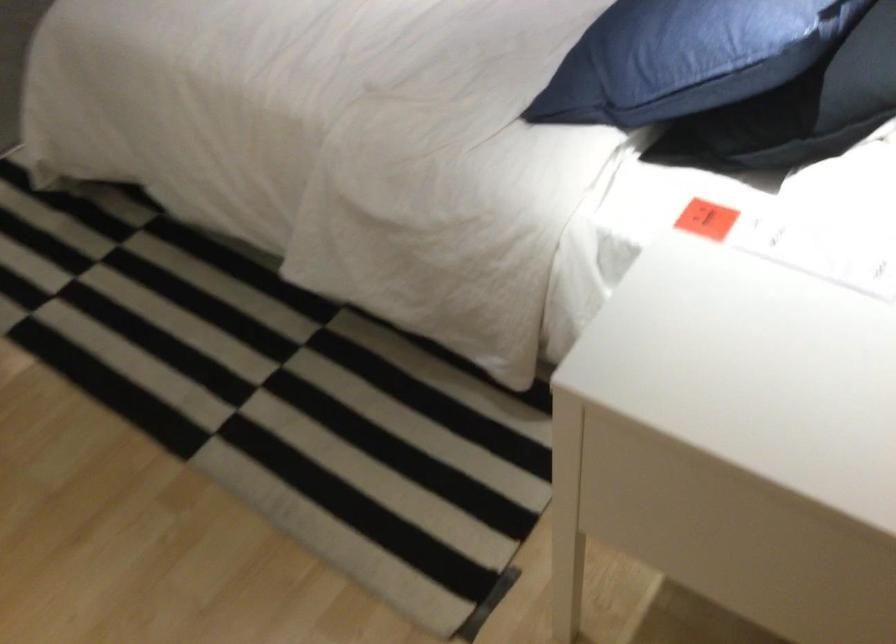
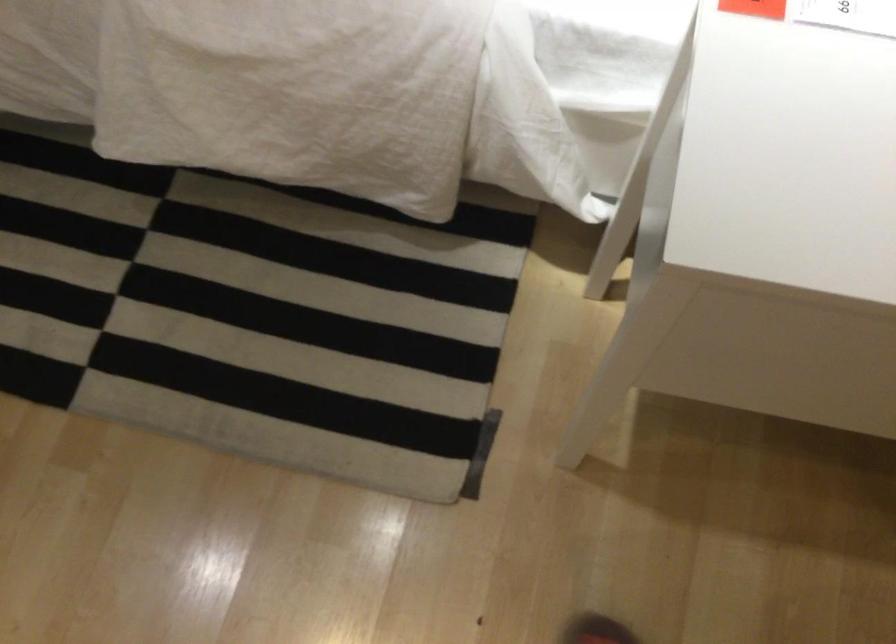
Question: How did the camera likely rotate?

Choices:
 (A) Left
 (B) Right
 (C) Up
 (D) Down

Answer: (D)